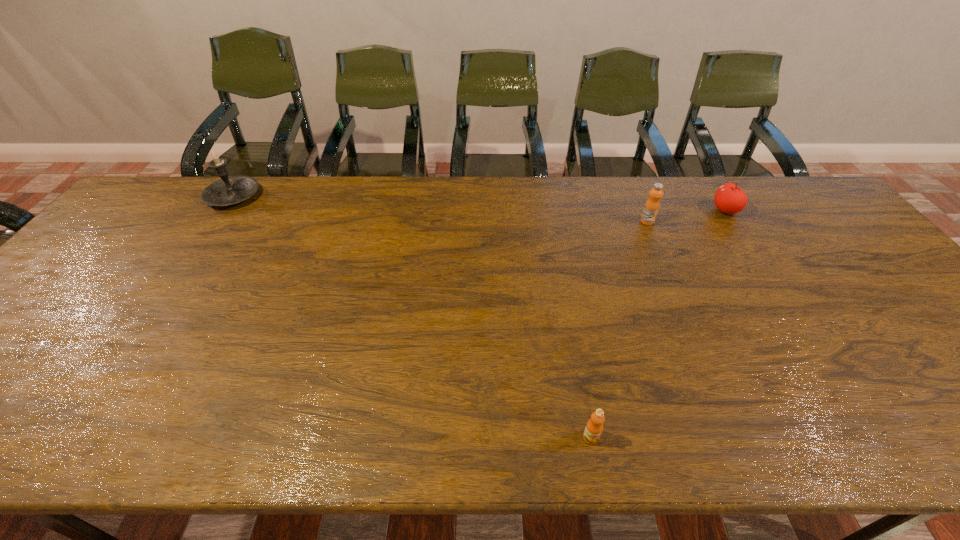
Locate an element on the screen. The height and width of the screenshot is (540, 960). vacant region that satisfies the following two spatial constraints: 1. on the front side of the apple; 2. on the left side of the tallest object is located at coordinates (224, 211).